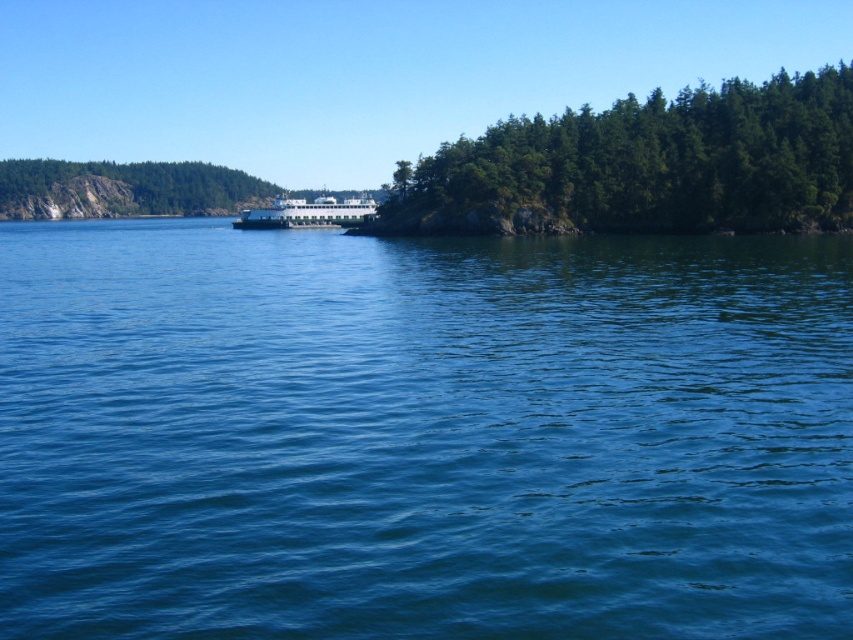
Question: Where is green leafy trees at right located in relation to white glossy ferry at center in the image?

Choices:
 (A) above
 (B) below

Answer: (A)

Question: Which of the following is the farthest from the observer?

Choices:
 (A) green matte rock at left
 (B) blue water at center
 (C) green leafy trees at right

Answer: (A)

Question: Can you confirm if green leafy trees at right is positioned below green matte rock at left?

Choices:
 (A) yes
 (B) no

Answer: (B)

Question: Which of the following is the farthest from the observer?

Choices:
 (A) (743, 96)
 (B) (200, 189)

Answer: (B)

Question: Which point is closer to the camera?

Choices:
 (A) white glossy ferry at center
 (B) green leafy trees at right

Answer: (B)

Question: Considering the relative positions of blue water at center and green matte rock at left in the image provided, where is blue water at center located with respect to green matte rock at left?

Choices:
 (A) below
 (B) above

Answer: (A)